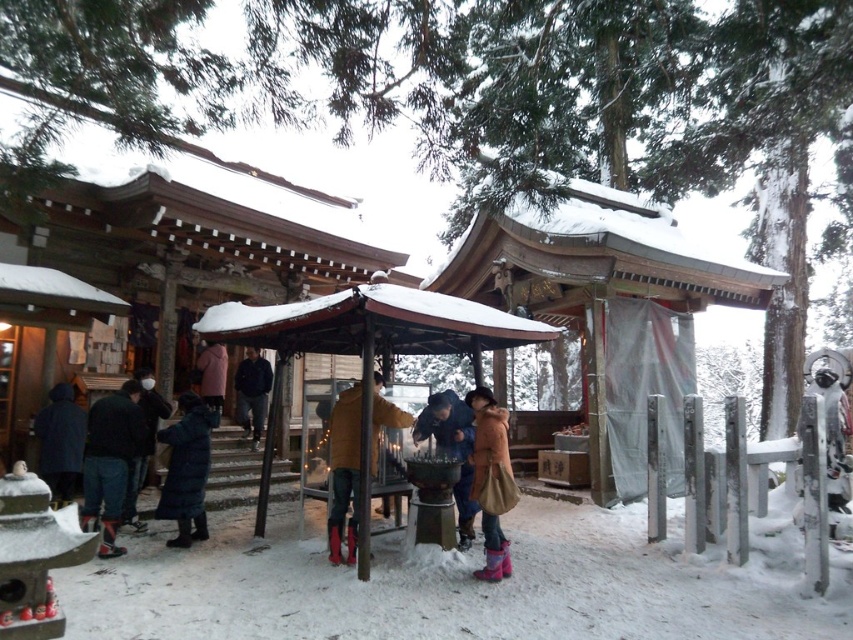
Who is more forward, (x=108, y=419) or (x=213, y=349)?

Point (x=108, y=419)

Who is lower down, dark blue jeans at left or matte pink coat at center?

dark blue jeans at left

Does point (96, 477) lie behind point (207, 394)?

That is False.

I want to click on dark blue jeans at left, so click(109, 461).

Between brown wooden gazebo at center and matte pink coat at center, which one appears on the right side from the viewer's perspective?

From the viewer's perspective, brown wooden gazebo at center appears more on the right side.

Does point (289, 323) come behind point (224, 348)?

No, (289, 323) is in front of (224, 348).

In order to click on brown wooden gazebo at center in this screenshot , I will do `click(372, 339)`.

Looking at this image, how far apart are wooden shrine at center and dark blue down jacket at center?

5.71 meters

In the scene shown: Is wooden shrine at center smaller than dark blue down jacket at center?

Incorrect, wooden shrine at center is not smaller in size than dark blue down jacket at center.

Who is more distant from viewer, (619,269) or (202,467)?

The point (619,269) is behind.

Identify the location of wooden shrine at center. This screenshot has height=640, width=853. (605, 300).